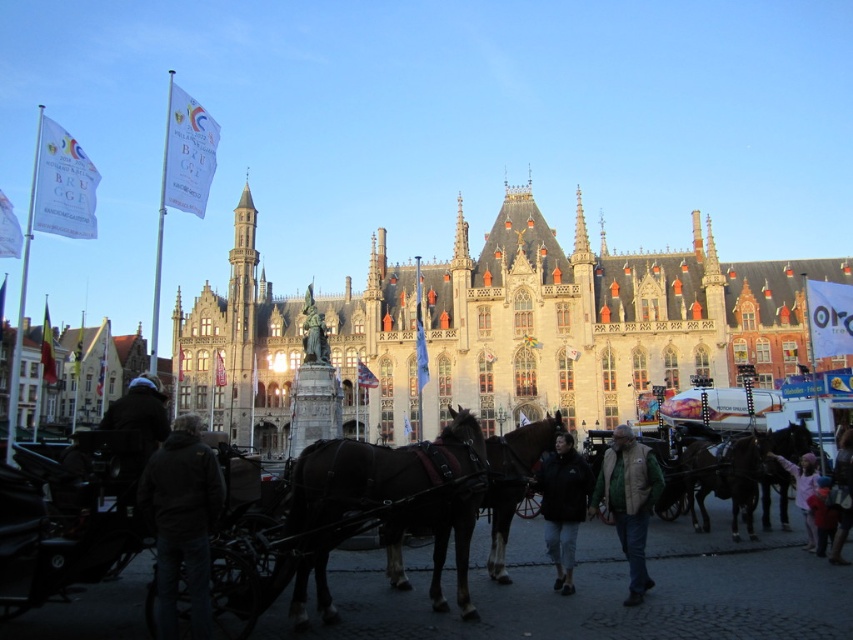
Is point (210, 488) behind point (515, 438)?

No, it is not.

You are a GUI agent. You are given a task and a screenshot of the screen. Output one action in this format:
    pyautogui.click(x=<x>, y=<y>)
    Task: Click on the dark gray jacket at lower left
    
    Given the screenshot: What is the action you would take?
    pyautogui.click(x=181, y=522)

Does point (206, 621) come behind point (815, 484)?

No, it is not.

Who is lower down, dark gray jacket at lower left or pink fabric at center?

pink fabric at center is lower down.

Is point (175, 476) closer to camera compared to point (802, 481)?

Yes, point (175, 476) is in front of point (802, 481).

Where is `dark gray jacket at lower left`? dark gray jacket at lower left is located at coordinates pos(181,522).

Does dark gray jacket at lower left appear on the right side of light brown leather jacket at lower right?

In fact, dark gray jacket at lower left is to the left of light brown leather jacket at lower right.

Find the location of a particular element. dark gray jacket at lower left is located at coordinates (181, 522).